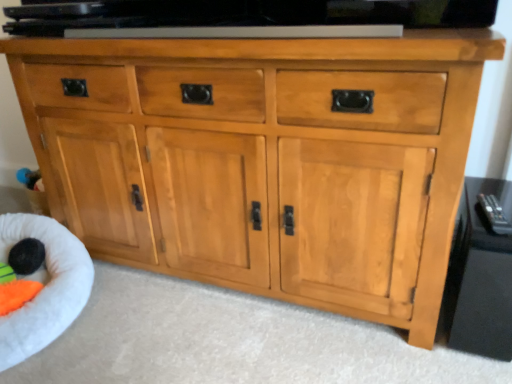
This screenshot has height=384, width=512. Find the location of `black fuzzy ball at lower left`. black fuzzy ball at lower left is located at coordinates (26, 256).

Measure the distance between black fuzzy ball at lower left and camera.

They are 4.53 feet apart.

Locate an element on the screen. glossy black tv stand at right is located at coordinates (479, 279).

Where is `white plush infant bed at lower left`? The image size is (512, 384). white plush infant bed at lower left is located at coordinates (44, 286).

Considering the positions of points (27, 253) and (69, 284), is point (27, 253) closer to camera compared to point (69, 284)?

No, it is behind (69, 284).

Who is smaller, black fuzzy ball at lower left or white plush infant bed at lower left?

black fuzzy ball at lower left is smaller.

Is black fuzzy ball at lower left positioned beyond the bounds of white plush infant bed at lower left?

That's incorrect, black fuzzy ball at lower left is not completely outside white plush infant bed at lower left.

Does glossy black tv stand at right have a greater width compared to white plush infant bed at lower left?

In fact, glossy black tv stand at right might be narrower than white plush infant bed at lower left.

Is glossy black tv stand at right positioned far away from white plush infant bed at lower left?

Indeed, glossy black tv stand at right is not near white plush infant bed at lower left.

Is white plush infant bed at lower left surrounded by glossy black tv stand at right?

No, white plush infant bed at lower left is not a part of glossy black tv stand at right.

Locate an element on the screen. The image size is (512, 384). side cabinet in front of the white plush infant bed at lower left is located at coordinates (479, 279).

Considering the points (33, 335) and (32, 269), which point is behind, point (33, 335) or point (32, 269)?

Point (32, 269)

Does white plush infant bed at lower left have a greater width compared to black fuzzy ball at lower left?

Indeed, white plush infant bed at lower left has a greater width compared to black fuzzy ball at lower left.

This screenshot has width=512, height=384. I want to click on infant bed on the left of black fuzzy ball at lower left, so click(44, 286).

Based on the photo, which object is positioned more to the right, white plush infant bed at lower left or black fuzzy ball at lower left?

black fuzzy ball at lower left is more to the right.

In the scene shown: Is white plush infant bed at lower left far from glossy black tv stand at right?

Absolutely, white plush infant bed at lower left is distant from glossy black tv stand at right.

How different are the orientations of white plush infant bed at lower left and glossy black tv stand at right in degrees?

The facing directions of white plush infant bed at lower left and glossy black tv stand at right are 57.9 degrees apart.

Is point (89, 263) closer to camera compared to point (487, 193)?

No.

Is white plush infant bed at lower left behind glossy black tv stand at right?

Yes.

Is glossy black tv stand at right spatially inside black fuzzy ball at lower left, or outside of it?

glossy black tv stand at right lies outside black fuzzy ball at lower left.

Does glossy black tv stand at right have a greater height compared to black fuzzy ball at lower left?

Correct, glossy black tv stand at right is much taller as black fuzzy ball at lower left.

I want to click on toy on the left of glossy black tv stand at right, so click(x=26, y=256).

What's the angular difference between black fuzzy ball at lower left and glossy black tv stand at right's facing directions?

The angle between the facing direction of black fuzzy ball at lower left and the facing direction of glossy black tv stand at right is 58.3 degrees.

From the image's perspective, is black fuzzy ball at lower left above glossy black tv stand at right?

Actually, black fuzzy ball at lower left appears below glossy black tv stand at right in the image.

Is black fuzzy ball at lower left touching glossy black tv stand at right?

No, black fuzzy ball at lower left is not touching glossy black tv stand at right.

Identify the location of infant bed below the black fuzzy ball at lower left (from a real-world perspective). (44, 286).

Where is `infant bed lying on the left of glossy black tv stand at right`? This screenshot has width=512, height=384. infant bed lying on the left of glossy black tv stand at right is located at coordinates (44, 286).

Considering their positions, is white plush infant bed at lower left positioned closer to black fuzzy ball at lower left than glossy black tv stand at right?

Based on the image, white plush infant bed at lower left appears to be nearer to black fuzzy ball at lower left.

Looking at this image, based on their spatial positions, is white plush infant bed at lower left or black fuzzy ball at lower left closer to glossy black tv stand at right?

white plush infant bed at lower left is closer to glossy black tv stand at right.

When comparing their distances from black fuzzy ball at lower left, does glossy black tv stand at right or white plush infant bed at lower left seem further?

glossy black tv stand at right is further to black fuzzy ball at lower left.

From the image, which object appears to be farther from white plush infant bed at lower left, black fuzzy ball at lower left or glossy black tv stand at right?

glossy black tv stand at right is further to white plush infant bed at lower left.

Estimate the real-world distances between objects in this image. Which object is closer to white plush infant bed at lower left, glossy black tv stand at right or black fuzzy ball at lower left?

Based on the image, black fuzzy ball at lower left appears to be nearer to white plush infant bed at lower left.

Estimate the real-world distances between objects in this image. Which object is further from glossy black tv stand at right, black fuzzy ball at lower left or white plush infant bed at lower left?

black fuzzy ball at lower left is positioned further to the anchor glossy black tv stand at right.

Where is `toy between white plush infant bed at lower left and glossy black tv stand at right`? toy between white plush infant bed at lower left and glossy black tv stand at right is located at coordinates (26, 256).